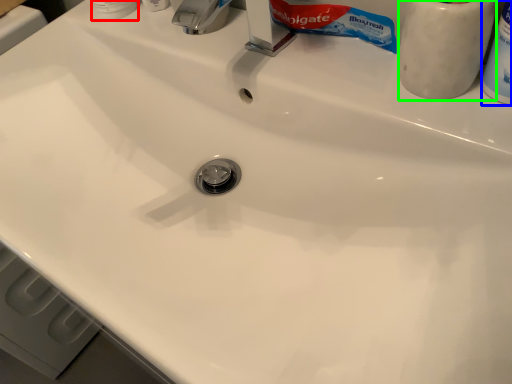
Question: Which object is the farthest from toiletry (highlighted by a red box)? Choose among these: toiletry (highlighted by a blue box) or toiletry (highlighted by a green box).

Choices:
 (A) toiletry
 (B) toiletry

Answer: (A)